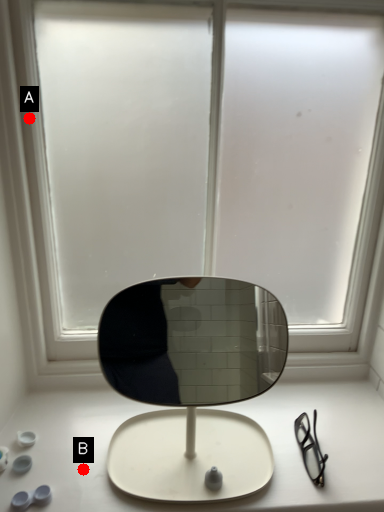
Question: Two points are circled on the image, labeled by A and B beside each circle. Among these points, which one is nearest to the camera?

Choices:
 (A) A is closer
 (B) B is closer

Answer: (B)